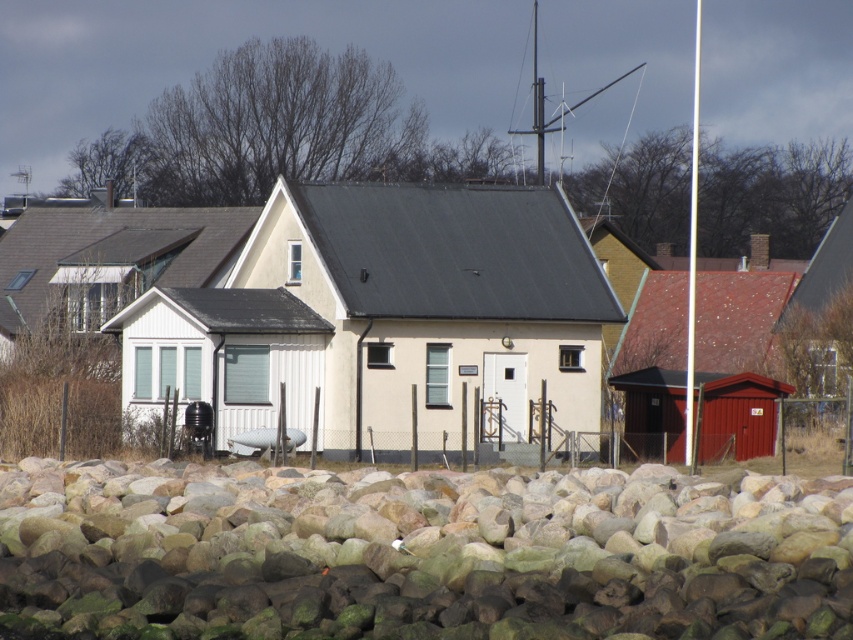
Question: Among these points, which one is farthest from the camera?

Choices:
 (A) (0, 284)
 (B) (834, 522)

Answer: (A)

Question: Which is nearer to the beige wood house at center?

Choices:
 (A) smooth red shed at right
 (B) white wood cabin at left

Answer: (A)

Question: Which is nearer to the white wood cabin at left?

Choices:
 (A) smooth red shed at right
 (B) beige wood house at center
 (C) smooth gray rock at lower center

Answer: (B)

Question: Does beige wood house at center appear under white wood cabin at left?

Choices:
 (A) yes
 (B) no

Answer: (A)

Question: Does white wood cabin at left appear under smooth red shed at right?

Choices:
 (A) no
 (B) yes

Answer: (A)

Question: Is the position of smooth gray rock at lower center less distant than that of beige wood house at center?

Choices:
 (A) yes
 (B) no

Answer: (A)